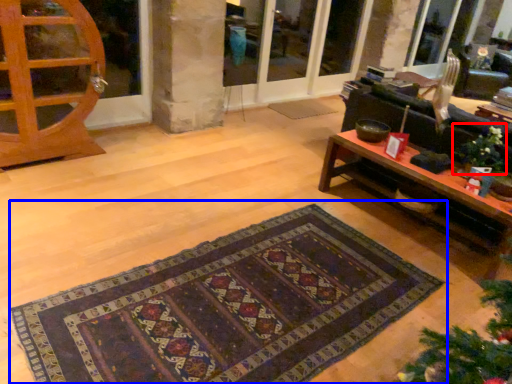
Question: Which object appears closest to the camera in this image, christmas decoration (highlighted by a red box) or mat (highlighted by a blue box)?

Choices:
 (A) christmas decoration
 (B) mat

Answer: (B)